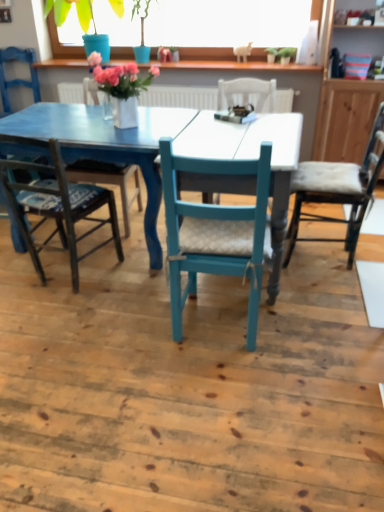
Question: Does point (23, 59) appear closer or farther from the camera than point (6, 91)?

Choices:
 (A) farther
 (B) closer

Answer: (B)

Question: From a real-world perspective, is matte blue chair at left, the 2th chair when ordered from left to right, positioned above or below matte blue chair at left, which is the sixth chair from right to left?

Choices:
 (A) below
 (B) above

Answer: (A)

Question: Estimate the real-world distances between objects in this image. Which object is farther from the matte blue chair at center, the 4th chair when ordered from right to left?

Choices:
 (A) matte blue chair at left, the first chair when ordered from left to right
 (B) matte blue pot at upper center
 (C) matte blue chair at center, positioned as the 4th chair in left-to-right order
 (D) white cushioned chair at right, which is the 6th chair in left-to-right order
 (E) teal wood chair at center, which appears as the 2th chair when viewed from the right

Answer: (B)

Question: Estimate the real-world distances between objects in this image. Which object is farther from the matte blue chair at center, the 4th chair when ordered from right to left?

Choices:
 (A) white cushioned chair at right, which is the 6th chair in left-to-right order
 (B) matte blue pot at upper center
 (C) teal wood chair at center, placed as the fifth chair when sorted from left to right
 (D) matte blue chair at center, positioned as the 4th chair in left-to-right order
 (E) matte blue chair at left, which is the sixth chair from right to left

Answer: (B)